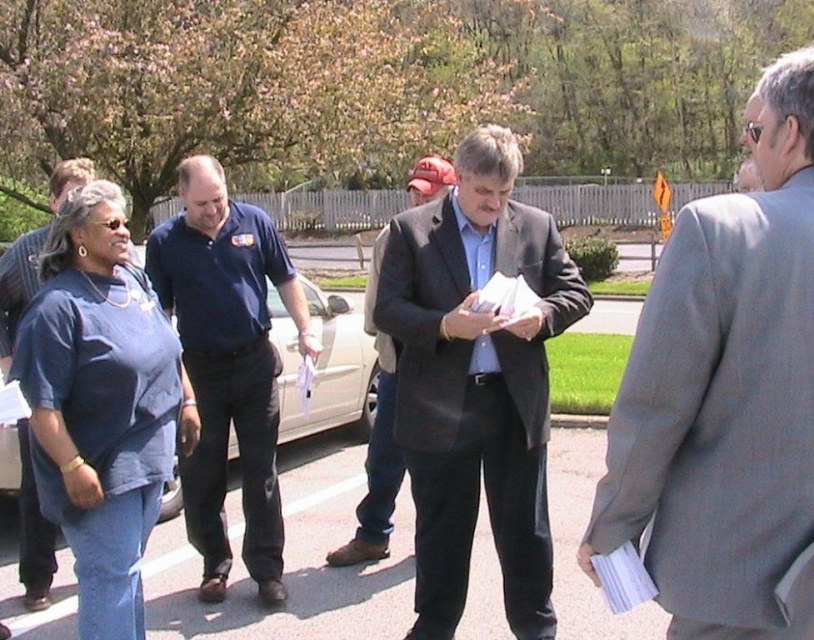
Is point (434, 218) closer to camera compared to point (279, 241)?

That is True.

Is point (478, 136) behind point (272, 596)?

No, it is not.

Between point (528, 420) and point (250, 516), which one is positioned behind?

Point (250, 516)

This screenshot has width=814, height=640. In order to click on dark gray suit at center in this screenshot , I will do `click(476, 381)`.

Is gray wool suit at right taller than dark gray wool coat at center?

No, gray wool suit at right is not taller than dark gray wool coat at center.

Who is higher up, gray wool suit at right or dark gray wool coat at center?

dark gray wool coat at center is higher up.

Is point (710, 449) positioned behind point (370, 444)?

That is False.

This screenshot has width=814, height=640. What are the coordinates of `gray wool suit at right` in the screenshot? It's located at (725, 396).

Based on the photo, does matte blue shirt at center appear on the right side of dark gray wool coat at center?

No, matte blue shirt at center is not to the right of dark gray wool coat at center.

Can you confirm if matte blue shirt at center is bigger than dark gray wool coat at center?

Actually, matte blue shirt at center might be smaller than dark gray wool coat at center.

Which is in front, point (93, 593) or point (370, 515)?

Point (93, 593) is in front.

I want to click on matte blue shirt at center, so click(x=101, y=404).